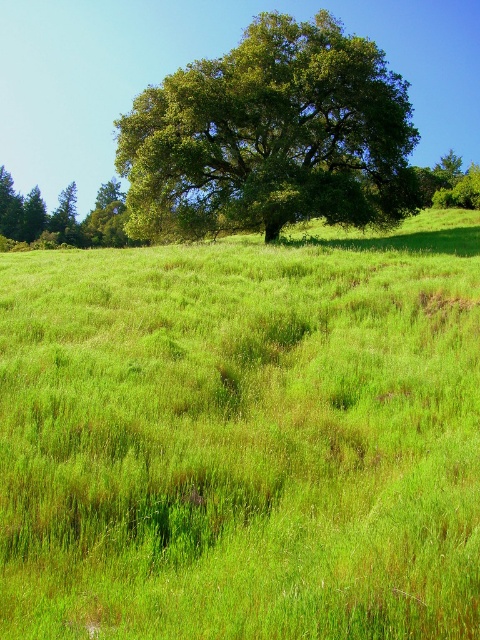
Can you confirm if green leafy tree at center is smaller than green leafy tree at upper left?

Correct, green leafy tree at center occupies less space than green leafy tree at upper left.

Is green leafy tree at center taller than green leafy tree at upper left?

Incorrect, green leafy tree at center's height is not larger of green leafy tree at upper left's.

Does point (351, 42) come behind point (15, 193)?

No.

Identify the location of green leafy tree at center. (271, 136).

Is green grassy pasture at center closer to camera compared to green leafy tree at center?

That is True.

Can you confirm if green grassy pasture at center is wider than green leafy tree at center?

Indeed, green grassy pasture at center has a greater width compared to green leafy tree at center.

Is point (218, 612) more distant than point (268, 49)?

No, (218, 612) is in front of (268, 49).

The width and height of the screenshot is (480, 640). In order to click on green grassy pasture at center in this screenshot , I will do `click(243, 435)`.

Does point (72, 458) come in front of point (40, 221)?

Yes, point (72, 458) is closer to viewer.

Is green grassy pasture at center below green leafy tree at upper left?

Indeed, green grassy pasture at center is positioned under green leafy tree at upper left.

Is point (36, 340) closer to camera compared to point (105, 200)?

Yes, it is.

The width and height of the screenshot is (480, 640). In order to click on green grassy pasture at center in this screenshot , I will do `click(243, 435)`.